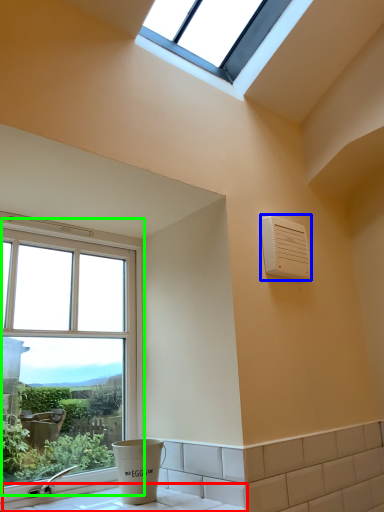
Question: Which object is the closest to the counter top (highlighted by a red box)? Choose among these: air conditioning (highlighted by a blue box) or window (highlighted by a green box).

Choices:
 (A) air conditioning
 (B) window

Answer: (B)